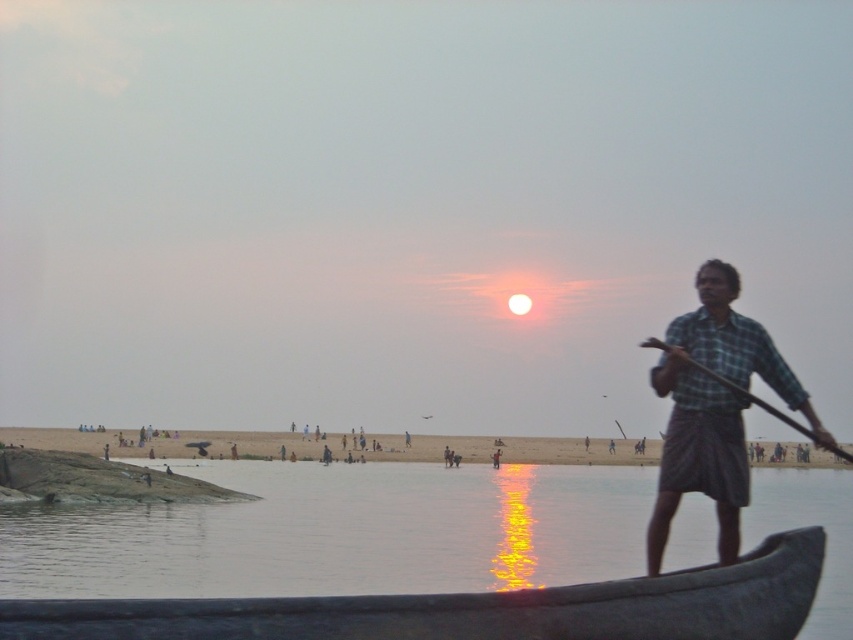
Question: Estimate the real-world distances between objects in this image. Which object is farther from the checkered fabric shirt at right?

Choices:
 (A) smooth water at boat front
 (B) wooden at right

Answer: (A)

Question: Does smooth water at boat front have a larger size compared to checkered fabric shirt at right?

Choices:
 (A) yes
 (B) no

Answer: (A)

Question: Is smooth water at boat front positioned in front of wooden at right?

Choices:
 (A) yes
 (B) no

Answer: (B)

Question: Which point is farther from the camera taking this photo?

Choices:
 (A) (424, 512)
 (B) (662, 516)
 (C) (648, 344)

Answer: (A)

Question: From the image, what is the correct spatial relationship of smooth water at boat front in relation to wooden at right?

Choices:
 (A) above
 (B) below

Answer: (B)

Question: Considering the real-world distances, which object is closest to the checkered fabric shirt at right?

Choices:
 (A) smooth water at boat front
 (B) wooden at right

Answer: (B)